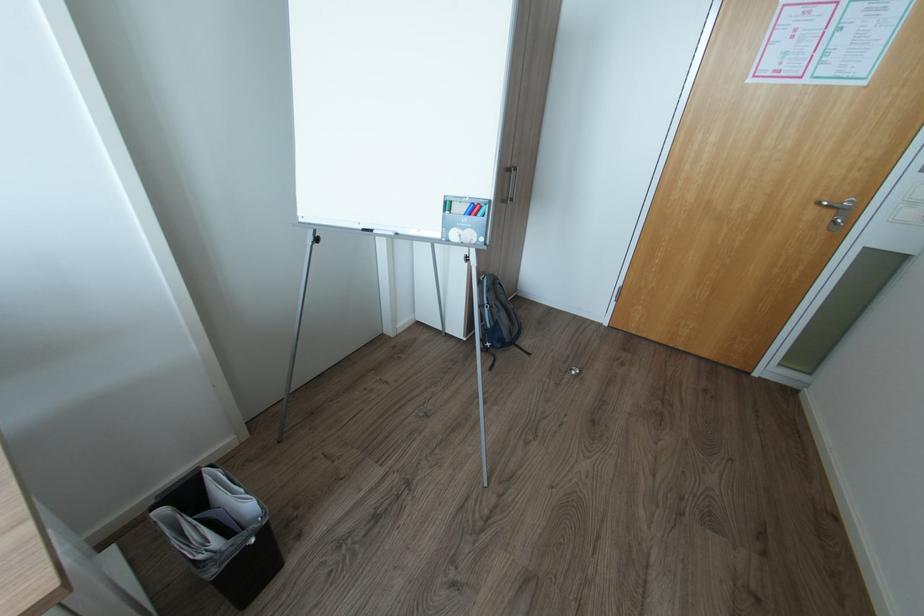
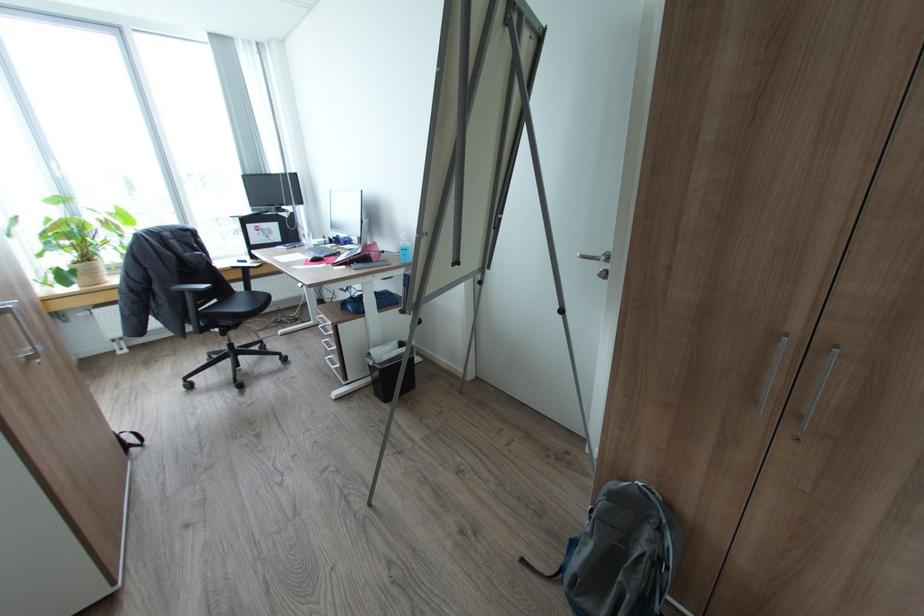
In the second image, find the point that corresponds to point (495, 368) in the first image.

(527, 560)